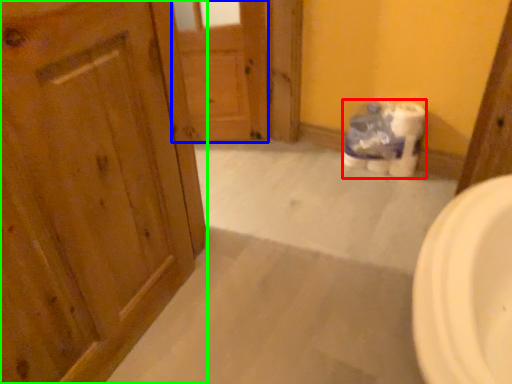
Question: Which object is the farthest from toilet paper (highlighted by a red box)? Choose among these: door (highlighted by a blue box) or door (highlighted by a green box).

Choices:
 (A) door
 (B) door

Answer: (B)